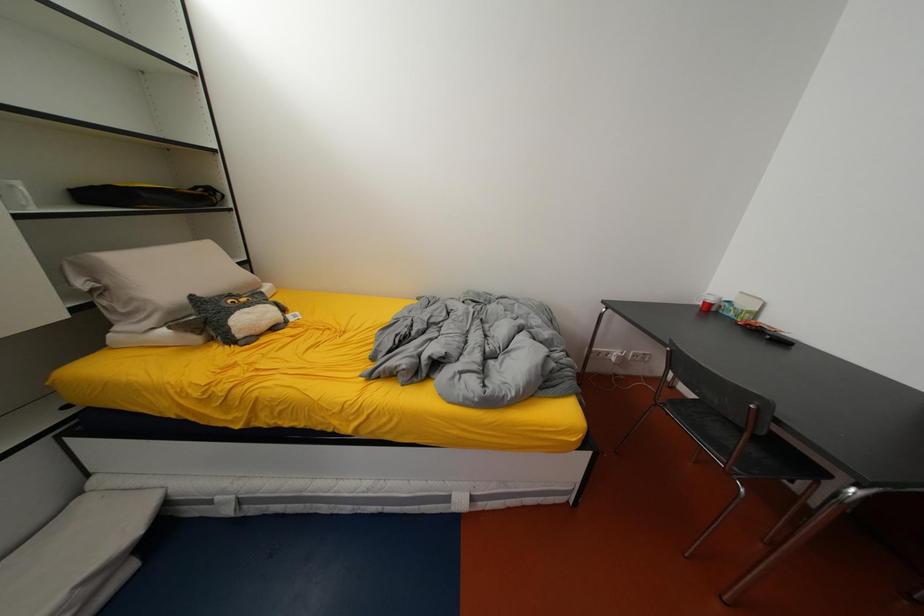
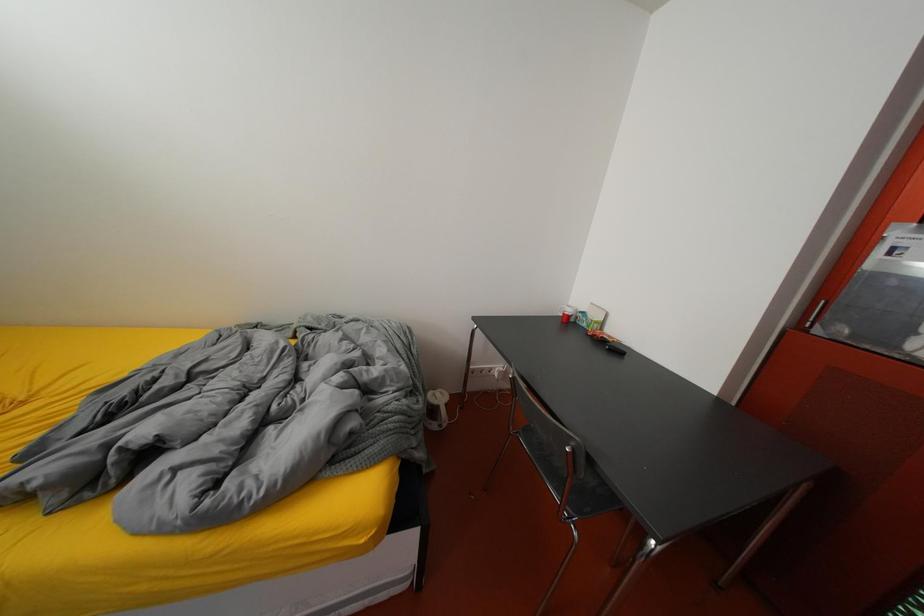
What movement of the cameraman would produce the second image?

The movement direction of the cameraman is right, forward.